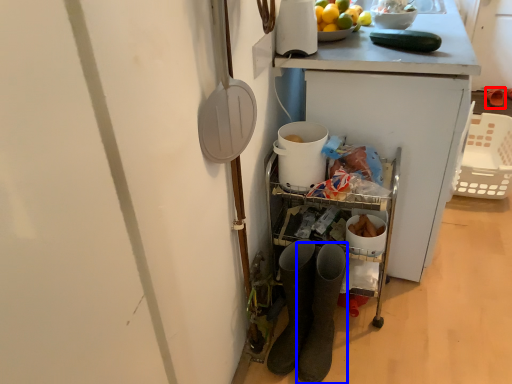
Question: Which point is closer to the camera, footwear (highlighted by a red box) or footwear (highlighted by a blue box)?

Choices:
 (A) footwear
 (B) footwear

Answer: (B)